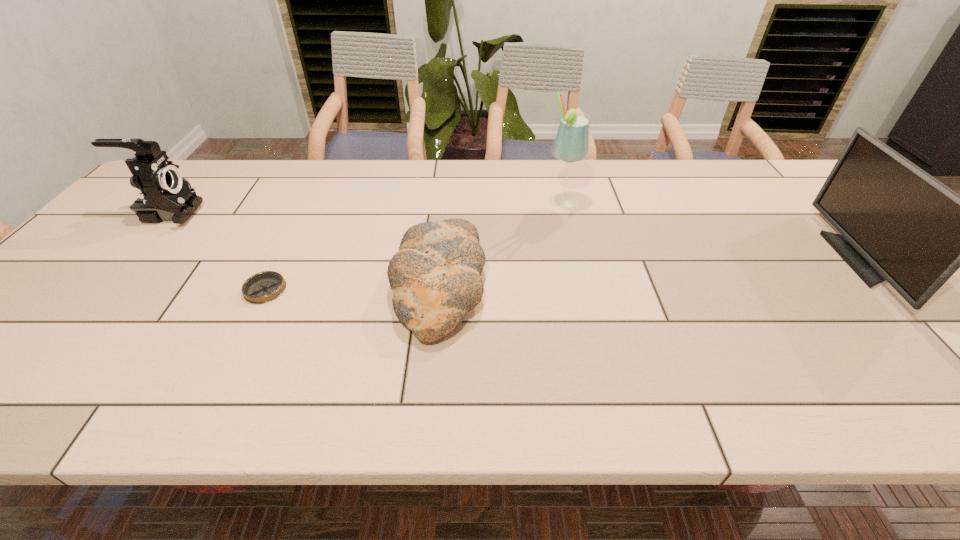
Find the location of `alcohol`. alcohol is located at coordinates (572, 141).

In order to click on the second object from right to left in this screenshot , I will do `click(572, 141)`.

What are the coordinates of `the rightmost object` in the screenshot? It's located at (898, 223).

Identify the location of the third shortest object. The image size is (960, 540). (164, 195).

Identify the location of camcorder. (164, 195).

I want to click on bread, so click(x=435, y=276).

Identify the location of the third object from right to left. (435, 276).

Find the location of a particular element. This screenshot has width=960, height=540. compass is located at coordinates (263, 287).

Where is `the fourth object from right to left`? This screenshot has height=540, width=960. the fourth object from right to left is located at coordinates (263, 287).

Where is `free space located 0.350m on the left of the tallest object`? This screenshot has width=960, height=540. free space located 0.350m on the left of the tallest object is located at coordinates (429, 201).